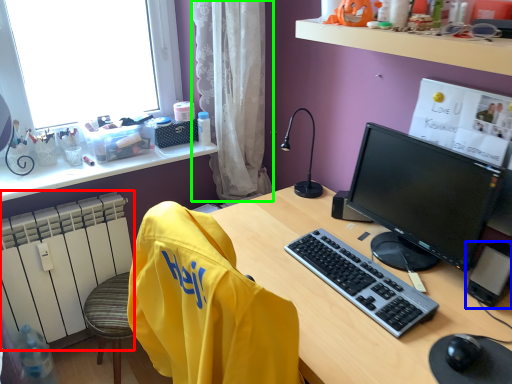
Question: Which is nearer to the radiator (highlighted by a red box)? computer tower (highlighted by a blue box) or curtain (highlighted by a green box).

Choices:
 (A) computer tower
 (B) curtain

Answer: (B)